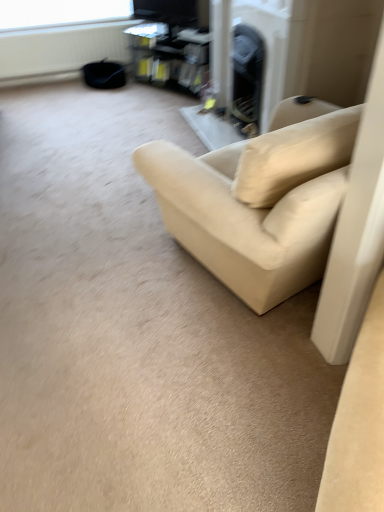
Question: Is white matte radiator at upper left wider or thinner than beige fabric couch at center?

Choices:
 (A) wide
 (B) thin

Answer: (B)

Question: Is white matte radiator at upper left bigger or smaller than beige fabric couch at center?

Choices:
 (A) big
 (B) small

Answer: (B)

Question: Based on their relative distances, which object is nearer to the white matte radiator at upper left?

Choices:
 (A) transparent plastic window screen at upper center
 (B) matte black entertainment center at upper center
 (C) beige fabric couch at center

Answer: (A)

Question: Which is nearer to the transparent plastic window screen at upper center?

Choices:
 (A) white matte radiator at upper left
 (B) beige fabric couch at center
 (C) matte black entertainment center at upper center

Answer: (A)